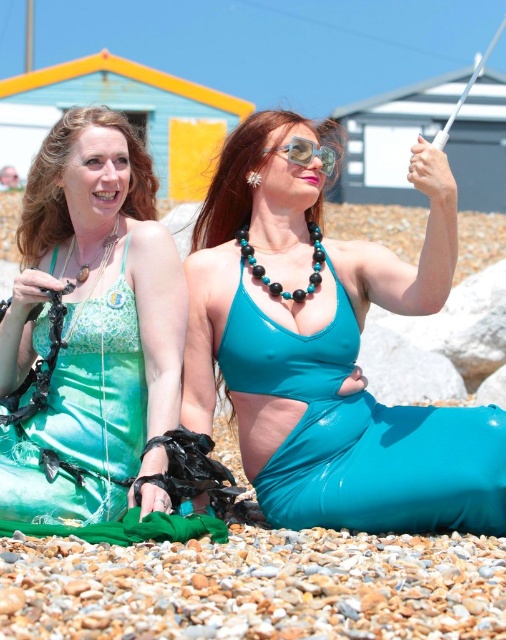
Is matte green mermaid suit at left below turquoise/black beaded necklace at center?

Yes.

From the picture: Can you confirm if matte green mermaid suit at left is positioned to the left of turquoise/black beaded necklace at center?

Yes, matte green mermaid suit at left is to the left of turquoise/black beaded necklace at center.

Does point (6, 392) come closer to viewer compared to point (261, 275)?

No.

Find the location of a particular element. This screenshot has width=506, height=640. matte green mermaid suit at left is located at coordinates (92, 323).

Describe the element at coordinates (92, 323) in the screenshot. I see `matte green mermaid suit at left` at that location.

Does matte green mermaid suit at left have a lesser height compared to green beaded necklace at upper left?

No.

Where is `matte green mermaid suit at left`? matte green mermaid suit at left is located at coordinates (92, 323).

Identify the location of matte green mermaid suit at left. (92, 323).

Measure the distance from turquoise/black beaded necklace at center to green beaded necklace at upper left.

11.68 feet

Is turquoise/black beaded necklace at center taller than green beaded necklace at upper left?

Incorrect, turquoise/black beaded necklace at center's height is not larger of green beaded necklace at upper left's.

Which is behind, point (323, 256) or point (76, 308)?

Positioned behind is point (323, 256).

Find the location of a particular element. turquoise/black beaded necklace at center is located at coordinates (278, 282).